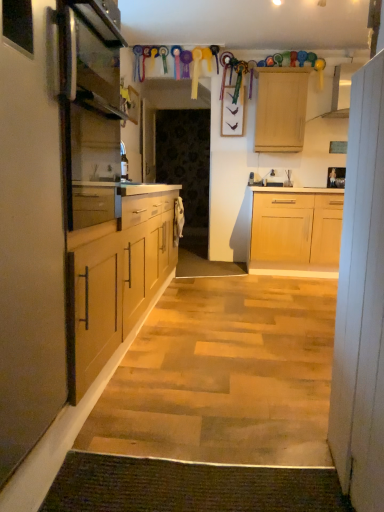
Question: Is white wood cabinet at right, the first cabinet in the right-to-left sequence, inside the boundaries of satin silver oven at left, or outside?

Choices:
 (A) inside
 (B) outside

Answer: (B)

Question: Considering the positions of white wood cabinet at right, the second cabinet viewed from the left, and satin silver oven at left in the image, is white wood cabinet at right, the second cabinet viewed from the left, wider or thinner than satin silver oven at left?

Choices:
 (A) thin
 (B) wide

Answer: (B)

Question: Based on their relative distances, which object is farther from the satin silver oven at left?

Choices:
 (A) white matte cabinet at left, acting as the first cabinet starting from the left
 (B) green textured mat at lower center
 (C) wooden cabinet at upper center
 (D) wooden picture frame at upper right
 (E) white wood cabinet at right, the second cabinet viewed from the left

Answer: (D)

Question: Estimate the real-world distances between objects in this image. Which object is farther from the wooden cabinet at upper center?

Choices:
 (A) satin silver oven at left
 (B) green textured mat at lower center
 (C) wooden picture frame at upper right
 (D) white matte cabinet at left, which appears as the 2th cabinet when viewed from the right
 (E) white wood cabinet at right, the second cabinet viewed from the left

Answer: (B)